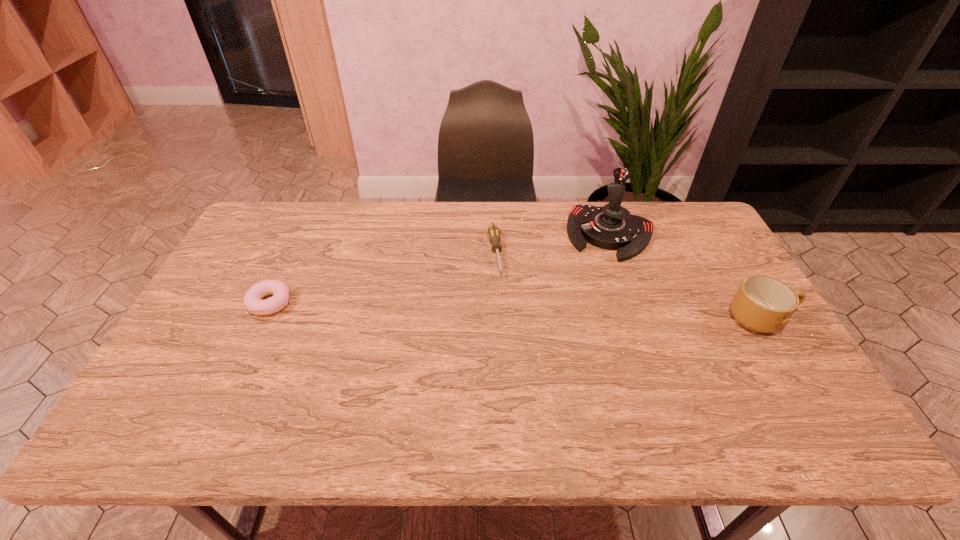
This screenshot has width=960, height=540. I want to click on free space on the desktop that is between the doughnut and the mug and is positioned at the tip of the screwdriver, so click(x=506, y=311).

Locate an element on the screen. free spot on the desktop that is between the doughnut and the second tallest object and is positioned on the handle side of the tallest object is located at coordinates (585, 314).